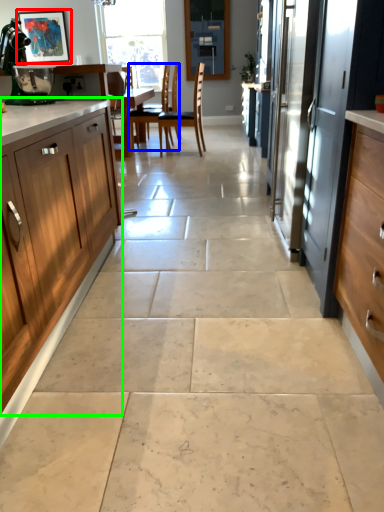
Question: Which object is positioned closest to picture frame (highlighted by a red box)? Select from chair (highlighted by a blue box) and cabinetry (highlighted by a green box).

Choices:
 (A) chair
 (B) cabinetry

Answer: (B)